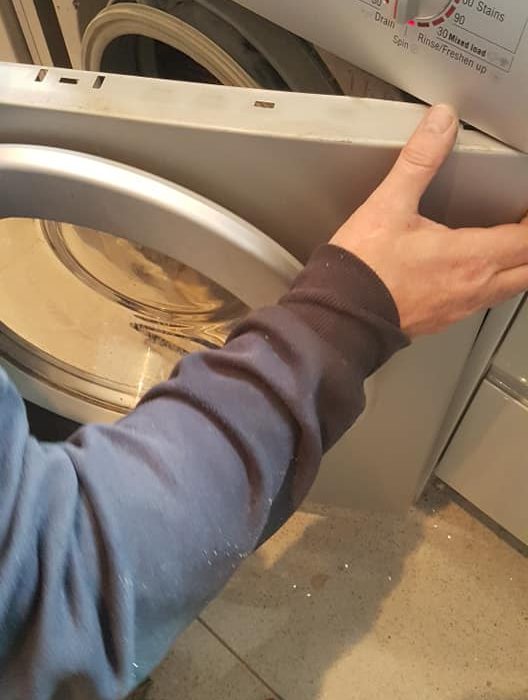
Image resolution: width=528 pixels, height=700 pixels. What are the coordinates of `stains` in the screenshot? It's located at (471, 1).